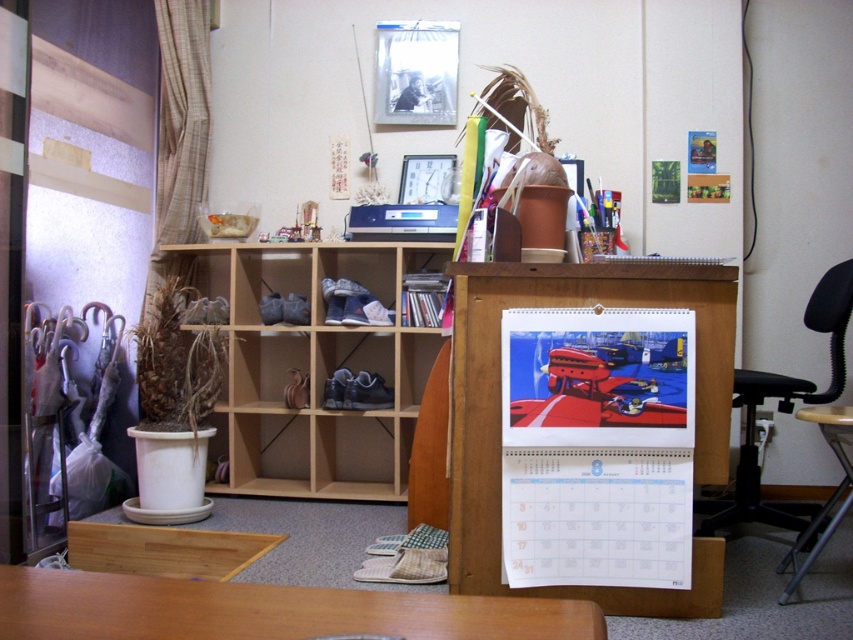
You are organizing a small event and need to seat 4 guests. You have a wooden table at lower center and a black plastic swivel chair at lower right. Which object can accommodate more guests comfortably?

The black plastic swivel chair at lower right can accommodate more guests comfortably since it has a larger size compared to the wooden table at lower center.